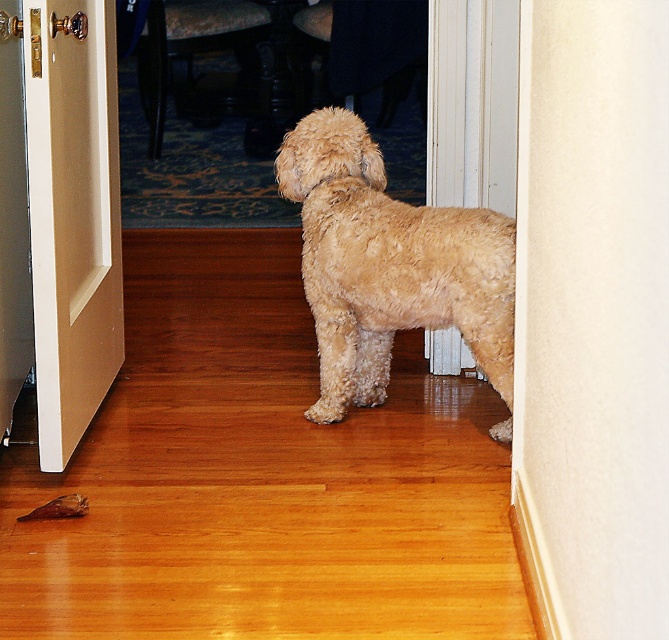
You are a delivery person trying to enter the room through the beige wood door at left. There is a fuzzy beige dog at center blocking your path. Can you walk around the dog without stepping outside the room?

The fuzzy beige dog at center is positioned under beige wood door at left, so you can walk around the dog on either side since it is under the door frame and not blocking the entire entrance.

You are a photographer standing behind the fuzzy beige dog at center. You want to take a picture of the dog from a distance of 3 meters. Can you move forward or backward to achieve this distance?

The fuzzy beige dog at center and camera are currently 2.81 meters apart. To achieve a distance of 3 meters, you need to move backward slightly so that the distance between you and the dog increases by approximately 0.19 meters.